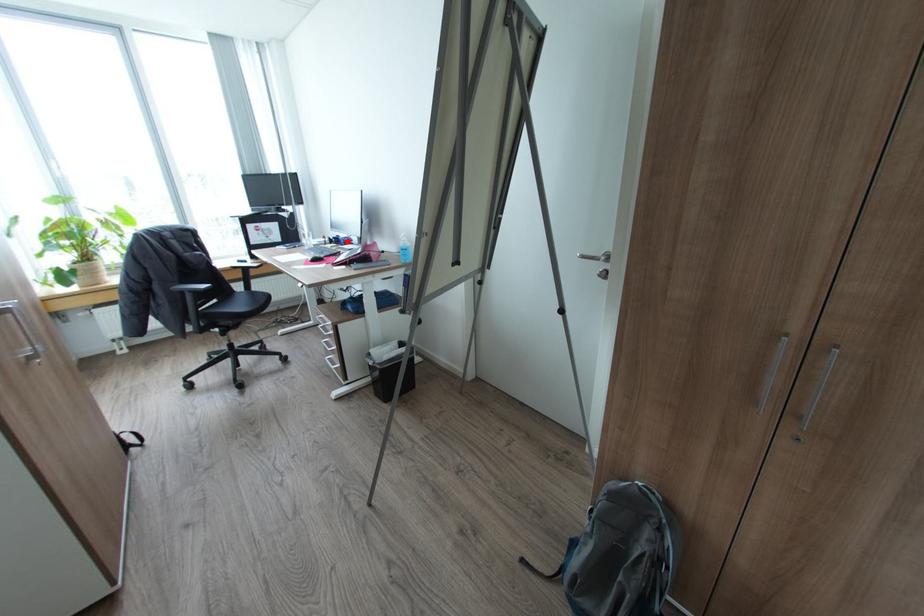
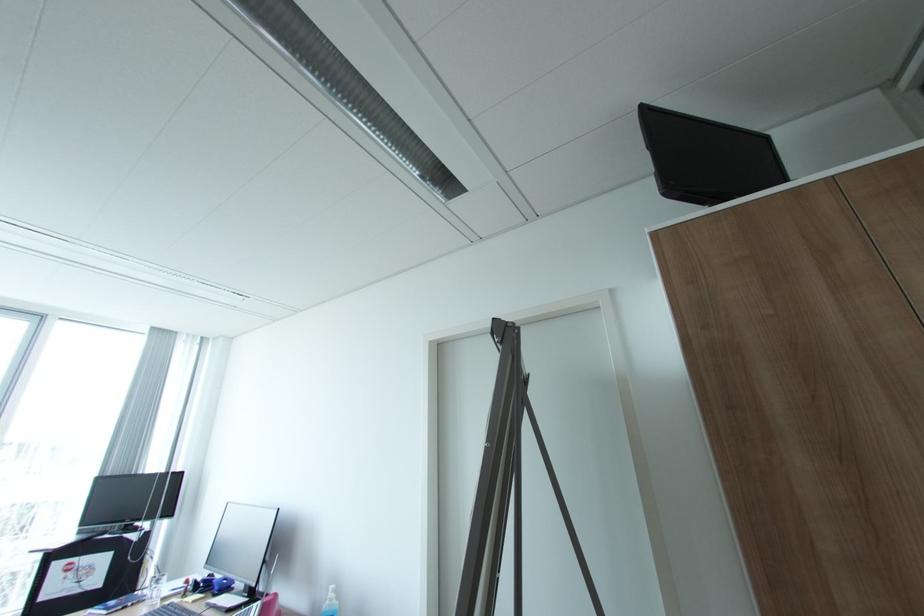
Locate, in the second image, the point that corresponds to the highlighted location in the first image.

(222, 588)